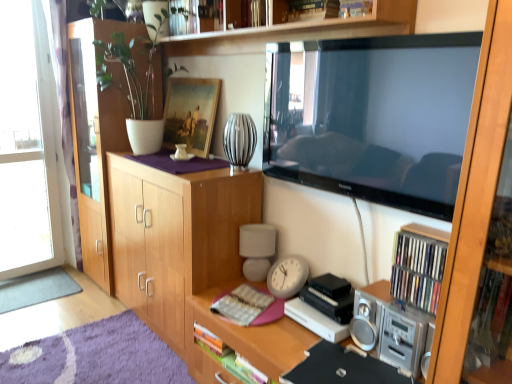
Question: From a real-world perspective, is transparent glass door at left under gray carpet at lower left?

Choices:
 (A) no
 (B) yes

Answer: (A)

Question: Can you confirm if transparent glass door at left is shorter than gray carpet at lower left?

Choices:
 (A) no
 (B) yes

Answer: (A)

Question: Would you say transparent glass door at left is outside gray carpet at lower left?

Choices:
 (A) yes
 (B) no

Answer: (A)

Question: Is transparent glass door at left taller than gray carpet at lower left?

Choices:
 (A) yes
 (B) no

Answer: (A)

Question: Considering the relative sizes of transparent glass door at left and gray carpet at lower left in the image provided, is transparent glass door at left thinner than gray carpet at lower left?

Choices:
 (A) yes
 (B) no

Answer: (A)

Question: Considering the relative positions of transparent glass door at left and gray carpet at lower left in the image provided, is transparent glass door at left to the right of gray carpet at lower left from the viewer's perspective?

Choices:
 (A) no
 (B) yes

Answer: (A)

Question: Is silver metallic stereo at lower right shorter than hardcover book at center?

Choices:
 (A) yes
 (B) no

Answer: (B)

Question: From the image's perspective, is silver metallic stereo at lower right above hardcover book at center?

Choices:
 (A) no
 (B) yes

Answer: (A)

Question: Considering the relative sizes of silver metallic stereo at lower right and hardcover book at center in the image provided, is silver metallic stereo at lower right smaller than hardcover book at center?

Choices:
 (A) no
 (B) yes

Answer: (A)

Question: From a real-world perspective, is silver metallic stereo at lower right located beneath hardcover book at center?

Choices:
 (A) no
 (B) yes

Answer: (A)

Question: From a real-world perspective, is silver metallic stereo at lower right physically above hardcover book at center?

Choices:
 (A) yes
 (B) no

Answer: (A)

Question: Is silver metallic stereo at lower right at the left side of hardcover book at center?

Choices:
 (A) yes
 (B) no

Answer: (B)

Question: Does white ceramic vase at upper left have a greater height compared to white matte lamp at center?

Choices:
 (A) no
 (B) yes

Answer: (B)